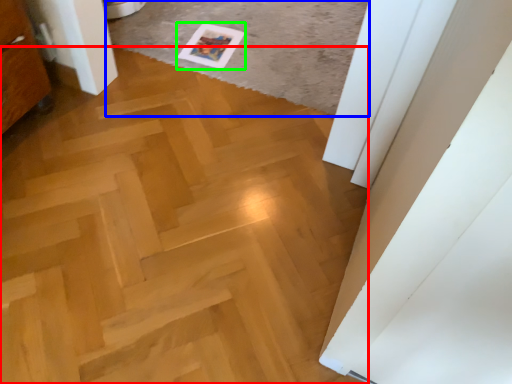
Question: Which is farther away from plywood (highlighted by a red box)? plain (highlighted by a blue box) or postcard (highlighted by a green box)?

Choices:
 (A) plain
 (B) postcard

Answer: (B)